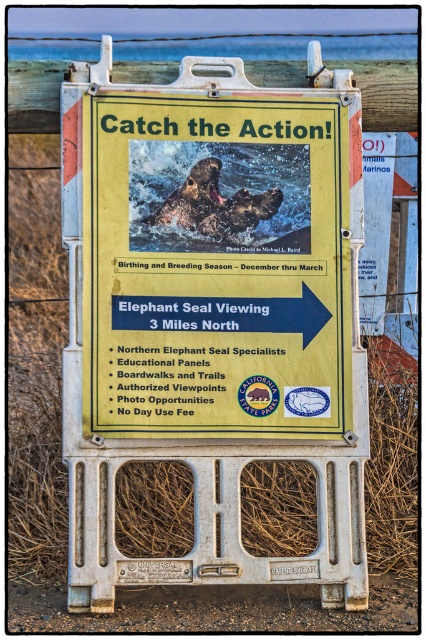
Can you confirm if yellow plastic sign at center is taller than grayish-brown elephant seal at center?

Yes, yellow plastic sign at center is taller than grayish-brown elephant seal at center.

Can you confirm if yellow plastic sign at center is thinner than grayish-brown elephant seal at center?

Incorrect, yellow plastic sign at center's width is not less than grayish-brown elephant seal at center's.

Does point (339, 154) come in front of point (181, 186)?

No, (339, 154) is further to viewer.

Where is `yellow plastic sign at center`? The height and width of the screenshot is (640, 426). yellow plastic sign at center is located at coordinates (213, 312).